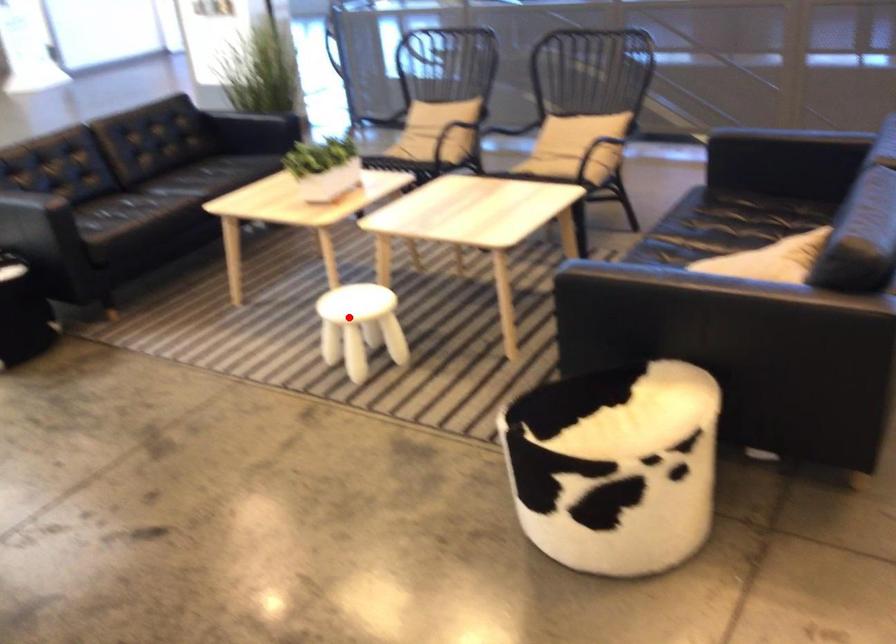
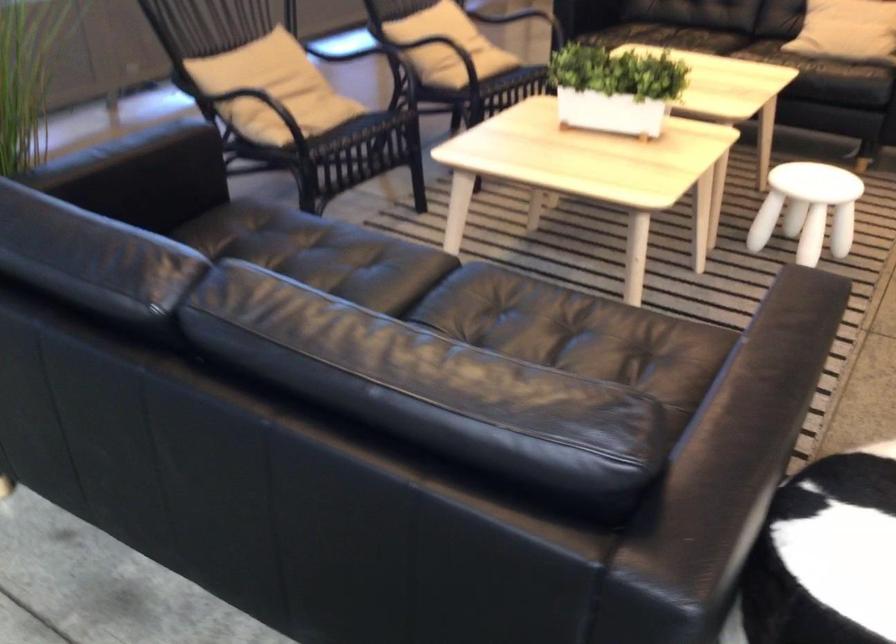
Question: A red point is marked in image1. In image2, is the corresponding 3D point closer to the camera or farther? Reply with the corresponding letter.

Choices:
 (A) The corresponding 3D point is closer.
 (B) The corresponding 3D point is farther.

Answer: (A)